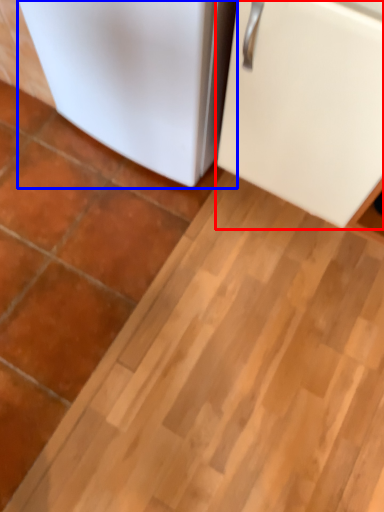
Question: Which of the following is the closest to the observer, refrigerator (highlighted by a red box) or refrigerator (highlighted by a blue box)?

Choices:
 (A) refrigerator
 (B) refrigerator

Answer: (A)